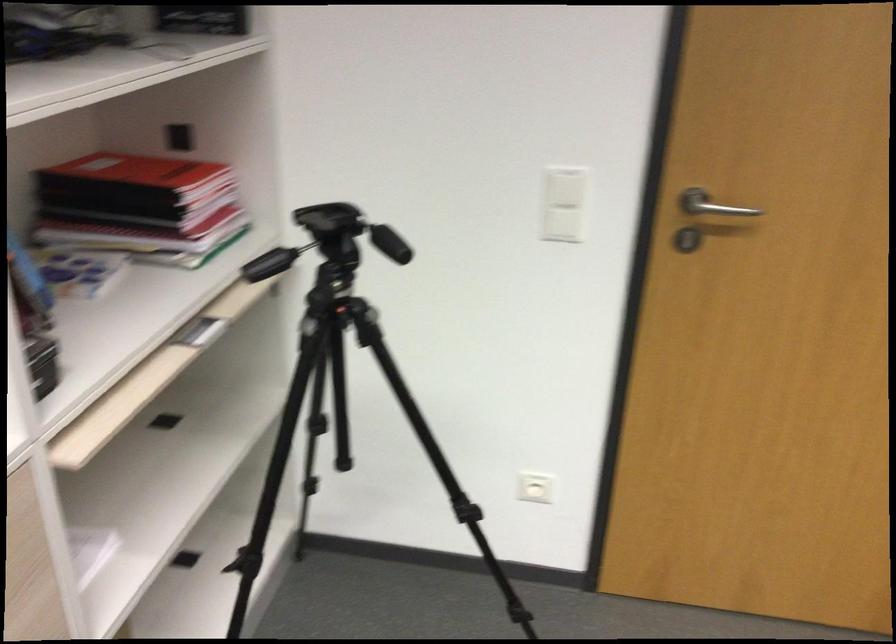
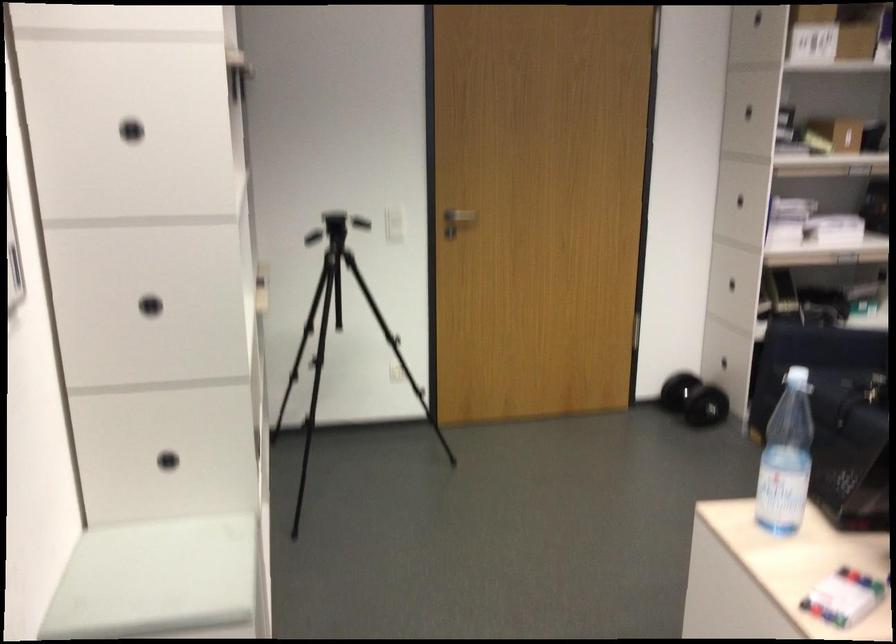
The images are taken continuously from a first-person perspective. In which direction are you moving?

The cameraman walked toward left, backward.